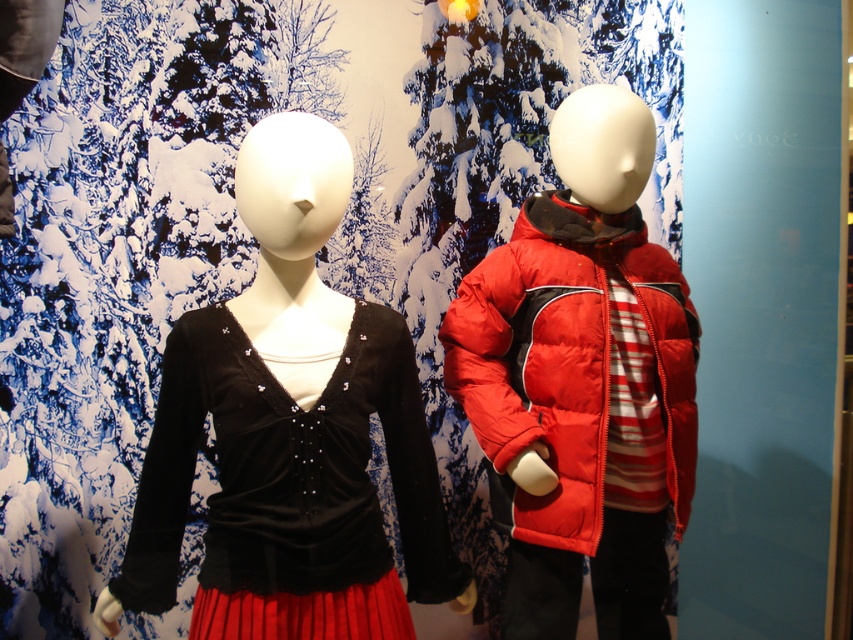
You are a store manager who needs to arrange the mannequins in a narrow hallway that is 16 inches wide. The velvet black top at center and the matte red puffer jacket at right are displayed on the mannequins. Can both mannequins fit side by side in the hallway without overlapping?

The velvet black top at center is 15.61 inches away from the matte red puffer jacket at right. Since the distance between them is less than the 16 inches width of the hallway, both mannequins can fit side by side without overlapping.

You are a fashion designer trying to decide which garment to display in a narrow store window. You have the velvet black top at center and the matte red puffer jacket at right. Based on their widths, which one would you choose to ensure it fits better in the narrow space?

The matte red puffer jacket at right is narrower than the velvet black top at center, so it would fit better in the narrow store window.